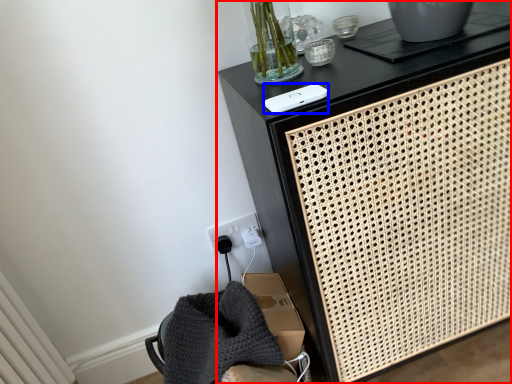
Question: Which of the following is the closest to the observer, furniture (highlighted by a red box) or ipod (highlighted by a blue box)?

Choices:
 (A) furniture
 (B) ipod

Answer: (A)